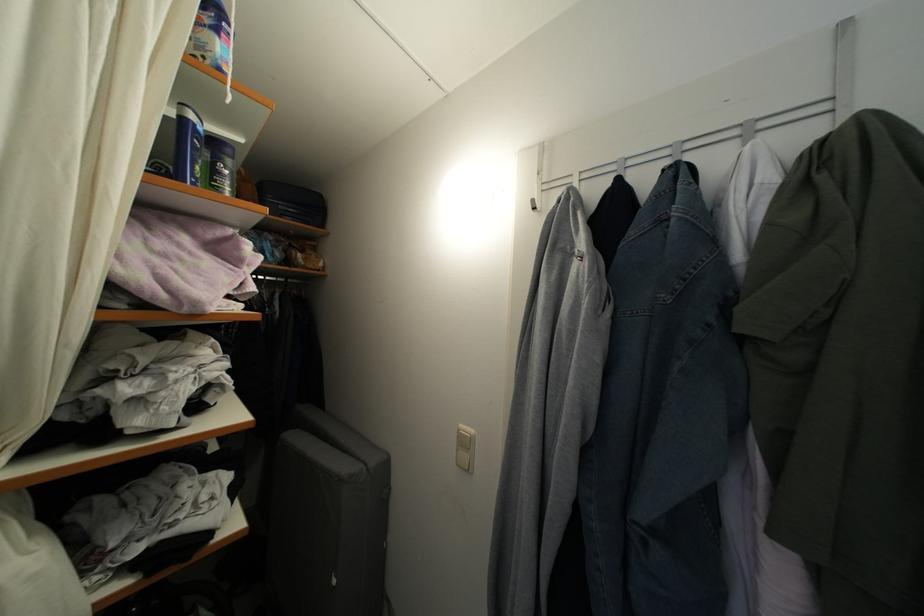
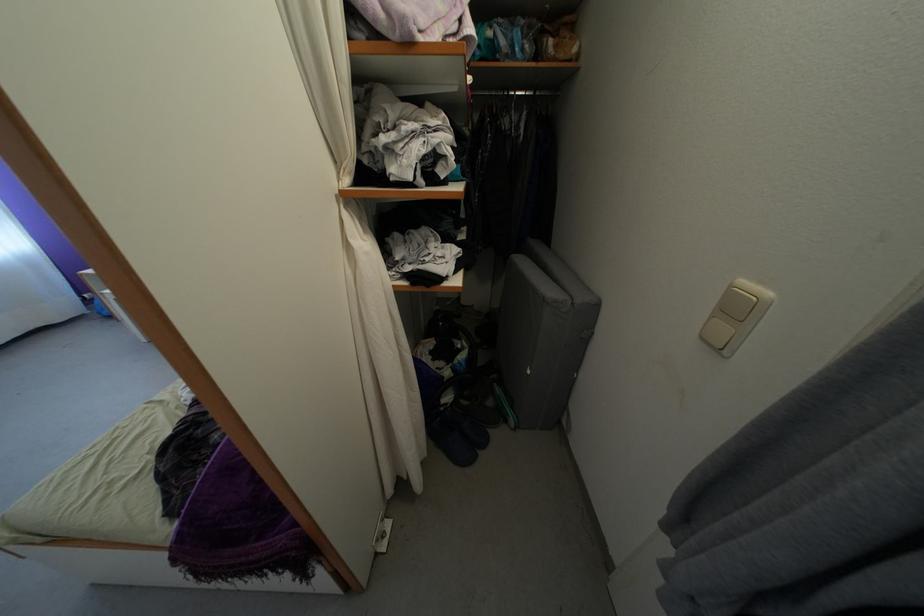
Find the pixel in the second image that matches pixel 470 448 in the first image.

(743, 315)